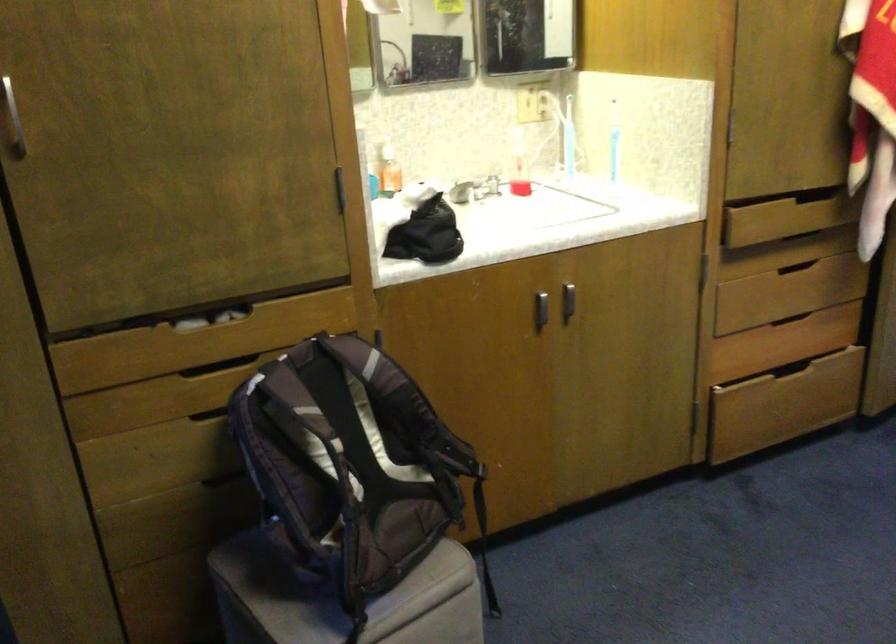
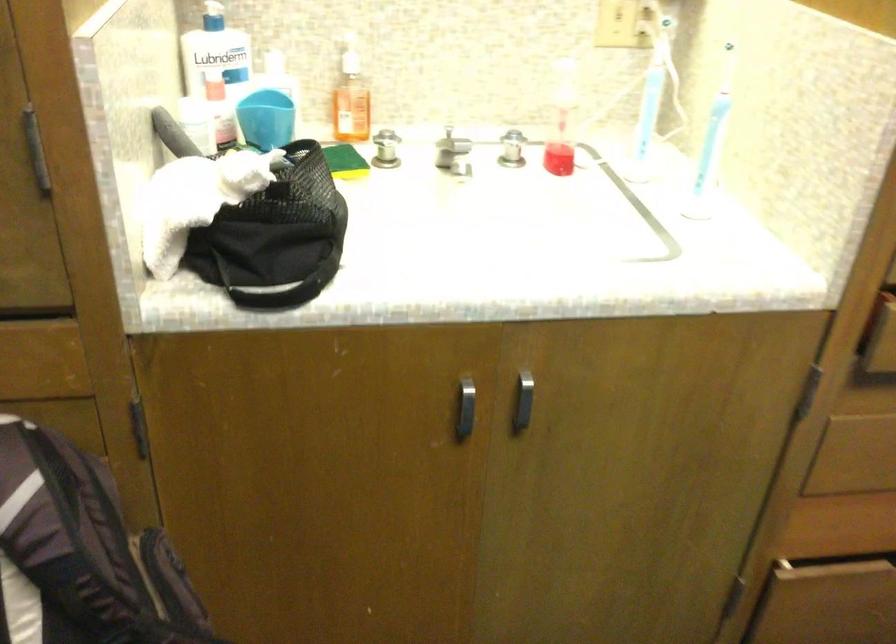
The point at (570, 140) is marked in the first image. Where is the corresponding point in the second image?

(650, 102)